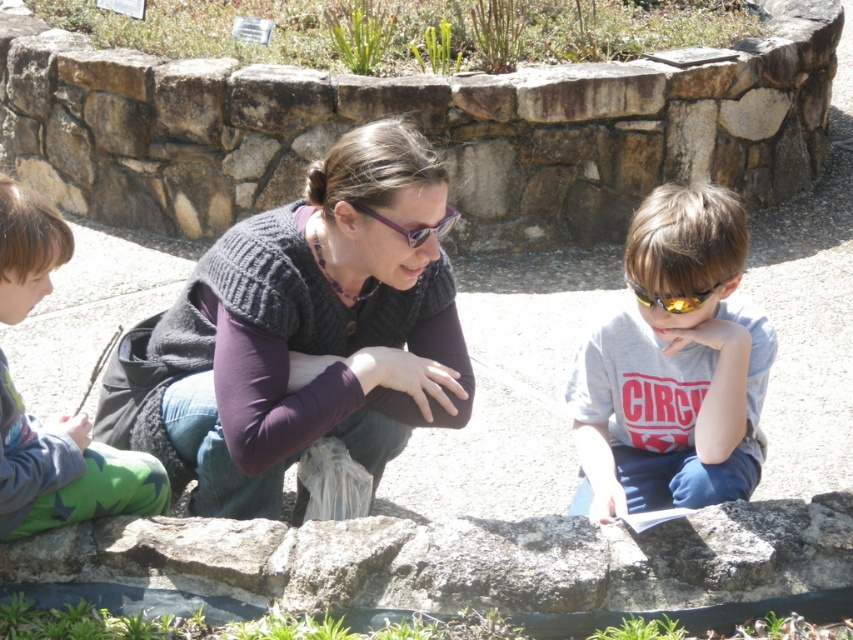
You are a photographer trying to capture a clear shot of the knitted gray sweater at center and the brown stone wall at center. Since the sweater is behind the wall, can you still see both objects in the photo?

The knitted gray sweater at center is behind the brown stone wall at center, so it would be obstructed and not visible in the photo. Only the brown stone wall at center would be visible.

You are a photographer trying to capture a closeup shot of both the purple plastic goggles at center and the yellow reflective lens sunglasses at center. Given that your camera can only focus on objects within a 15 inch range, will you be able to get both items in focus at the same time?

The purple plastic goggles at center and yellow reflective lens sunglasses at center are 20.21 inches apart, which exceeds the camera focus range of 15 inches. Therefore, you won the be able to get both items in focus simultaneously.